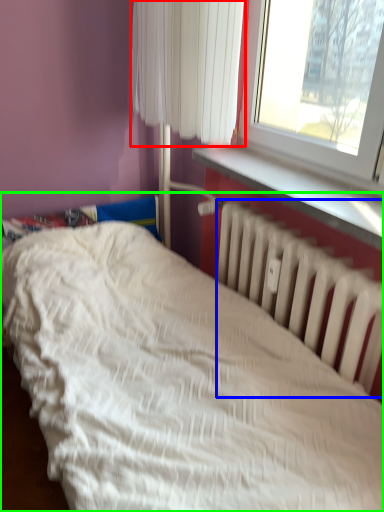
Question: Based on their relative distances, which object is nearer to curtain (highlighted by a red box)? Choose from radiator (highlighted by a blue box) and bed (highlighted by a green box).

Choices:
 (A) radiator
 (B) bed

Answer: (A)